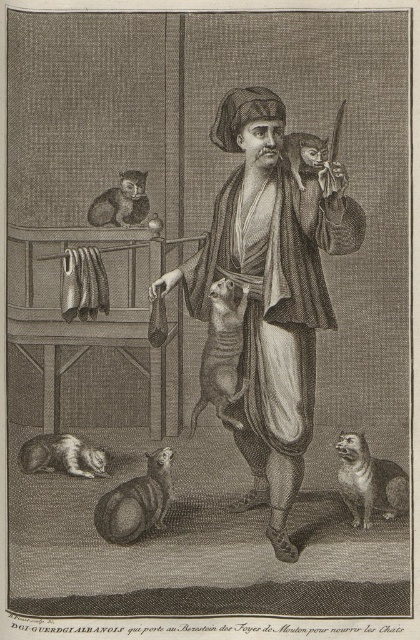
The height and width of the screenshot is (640, 420). Describe the element at coordinates (270, 292) in the screenshot. I see `brown leather bag at center` at that location.

Who is positioned more to the left, brown leather bag at center or fluffy brown cat at center?

Answer: fluffy brown cat at center

Does point (275, 467) come closer to viewer compared to point (147, 198)?

Yes, point (275, 467) is in front of point (147, 198).

Locate an element on the screen. This screenshot has width=420, height=640. brown leather bag at center is located at coordinates (270, 292).

Can you confirm if striped fur cat at center is shorter than fluffy brown cat at lower center?

In fact, striped fur cat at center may be taller than fluffy brown cat at lower center.

Who is taller, striped fur cat at center or fluffy brown cat at lower center?

Standing taller between the two is striped fur cat at center.

Looking at this image, measure the distance between striped fur cat at center and camera.

The distance of striped fur cat at center from camera is 3.44 meters.

Identify the location of striped fur cat at center. The width and height of the screenshot is (420, 640). (222, 355).

Which is below, fluffy gray cat at lower left or fluffy brown cat at upper center?

fluffy gray cat at lower left is below.

Who is positioned more to the left, fluffy gray cat at lower left or fluffy brown cat at upper center?

fluffy gray cat at lower left

Who is more distant from viewer, [88,468] or [330,168]?

Point [88,468]

The height and width of the screenshot is (640, 420). Identify the location of fluffy gray cat at lower left. (63, 456).